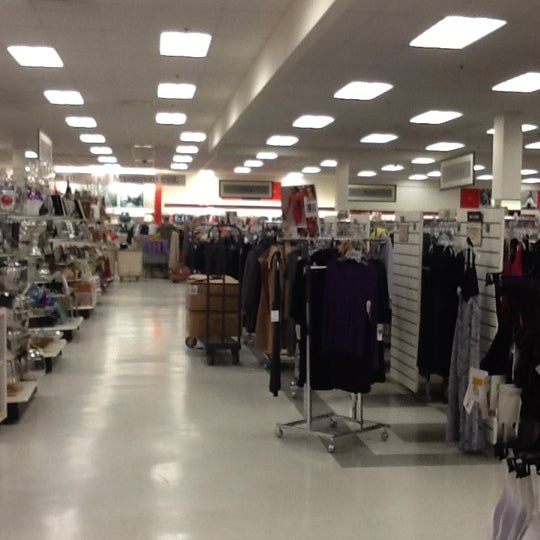
The width and height of the screenshot is (540, 540). What are the coordinates of `ceiling` in the screenshot? It's located at (119, 92), (438, 82).